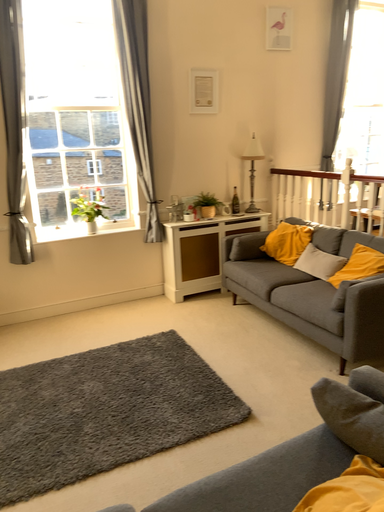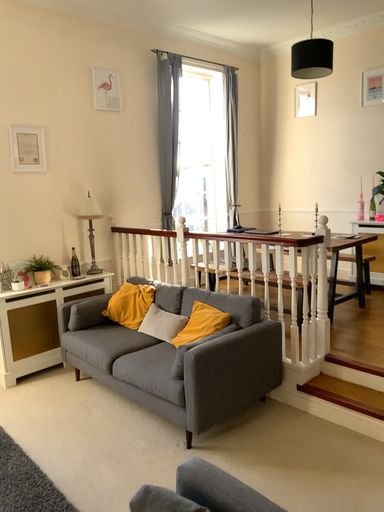
Question: Which way did the camera rotate in the video?

Choices:
 (A) rotated downward
 (B) rotated upward

Answer: (B)